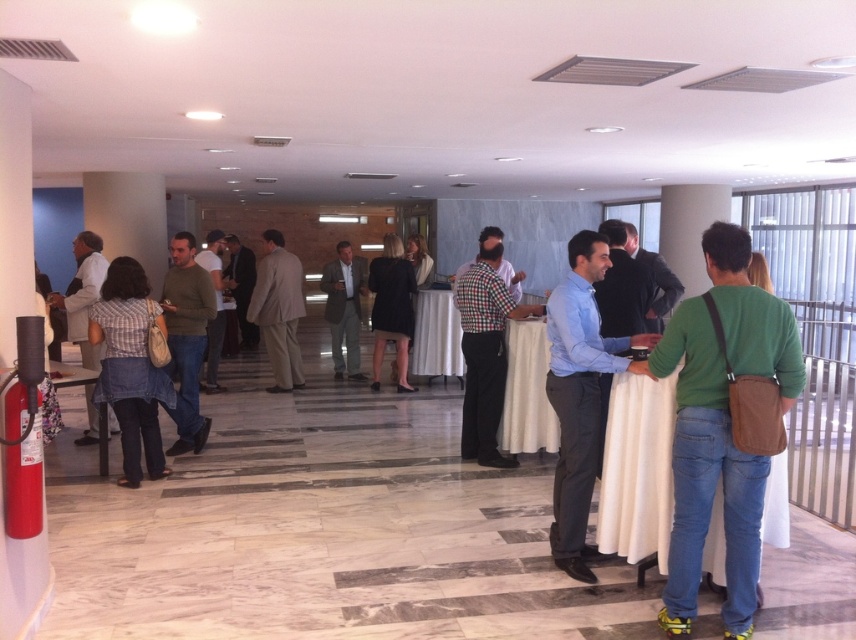
You are a photographer at the event and want to capture a photo of both the denim shirt at left and the light gray suit at center. Which of the two should you focus on first if you want to ensure both are in the frame without moving the camera?

The denim shirt at left is positioned under the light gray suit at center, so focusing on the light gray suit at center first will ensure both are in the frame since the denim shirt at left is below it.

You are a photographer at the event and want to capture a photo of both the black fabric dress at center and the matte gray blazer at left. The camera you are using has a maximum focus range of 9 feet. Can you capture both subjects in focus without moving the camera?

The black fabric dress at center is 9.15 feet from the matte gray blazer at left. Since the distance between them exceeds the camera maximum focus range of 9 feet, you cannot capture both subjects in focus without moving the camera.

You are at the entrance of the conference hall and want to find the person wearing the light beige suit at center. According to the coordinates provided, in which direction should you look to locate them?

The light beige suit at center is located at coordinates point (278, 310), so you should look towards the center of the room to find them.